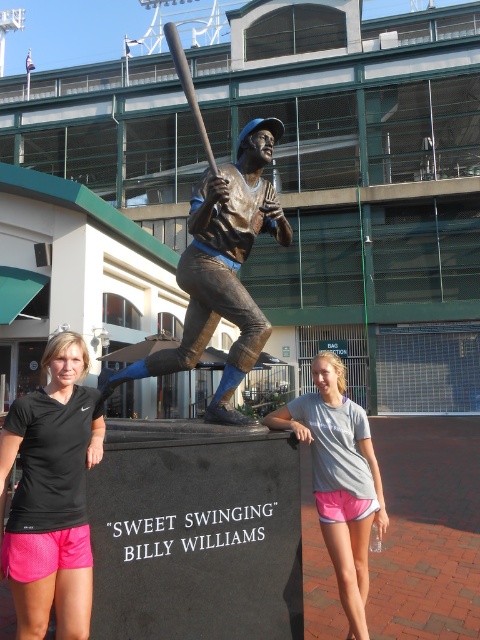
From the picture: You are a photographer planning to take a group photo of the black athletic wear at center and the bronze statue at center. Since the statue is part of the scene, you want to ensure both subjects are clearly visible. Considering their sizes, which subject should you focus on first to ensure proper framing?

The black athletic wear at center has a larger size compared to the bronze statue at center, so you should focus on the black athletic wear at center first to ensure proper framing.